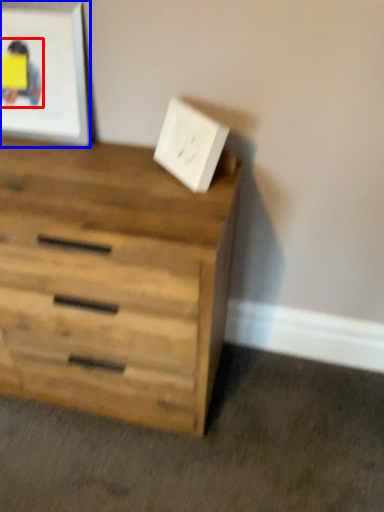
Question: Which point is closer to the camera, person (highlighted by a red box) or picture frame (highlighted by a blue box)?

Choices:
 (A) person
 (B) picture frame

Answer: (B)